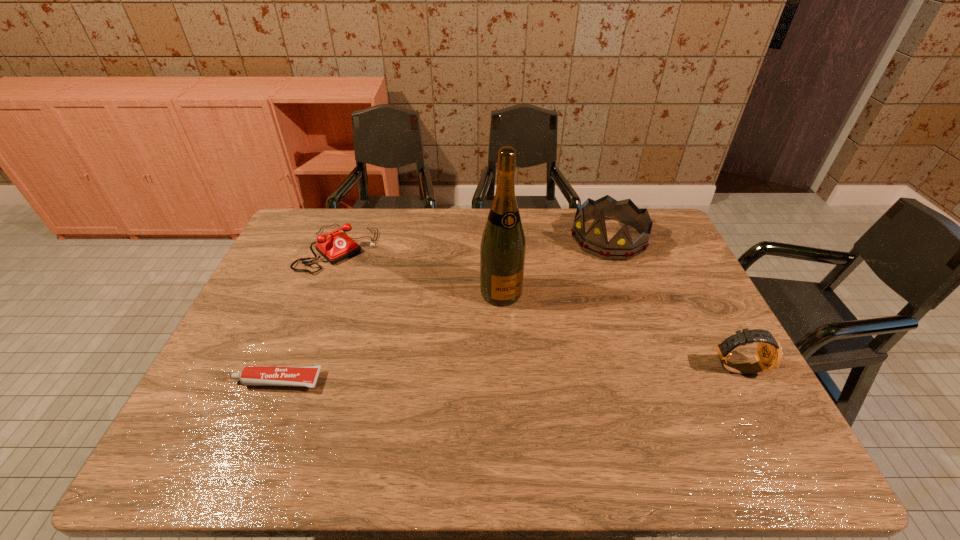
The height and width of the screenshot is (540, 960). In order to click on toothpaste in this screenshot , I will do `click(303, 376)`.

I want to click on watch, so click(x=769, y=354).

This screenshot has height=540, width=960. I want to click on the third tallest object, so click(x=769, y=354).

Where is `the tallest object`? This screenshot has height=540, width=960. the tallest object is located at coordinates (502, 250).

Where is `the third object from left to right`? the third object from left to right is located at coordinates (502, 250).

At what (x,y) coordinates should I click in order to perform the action: click on tiara. Please return your answer as a coordinate pair (x, y). Looking at the image, I should click on (595, 241).

Where is `the fourth shortest object`? The height and width of the screenshot is (540, 960). the fourth shortest object is located at coordinates (595, 241).

Locate an element on the screen. This screenshot has width=960, height=540. the fourth tallest object is located at coordinates (338, 246).

You are a GUI agent. You are given a task and a screenshot of the screen. Output one action in this format:
    pyautogui.click(x=<x>, y=<y>)
    Task: Click on the free space located 0.360m on the front-facing side of the third object from right to left
    The height and width of the screenshot is (540, 960).
    Given the screenshot: What is the action you would take?
    pyautogui.click(x=564, y=413)

Image resolution: width=960 pixels, height=540 pixels. Identify the location of vacant space positioned on the front-facing side of the third object from right to left. pyautogui.click(x=520, y=329).